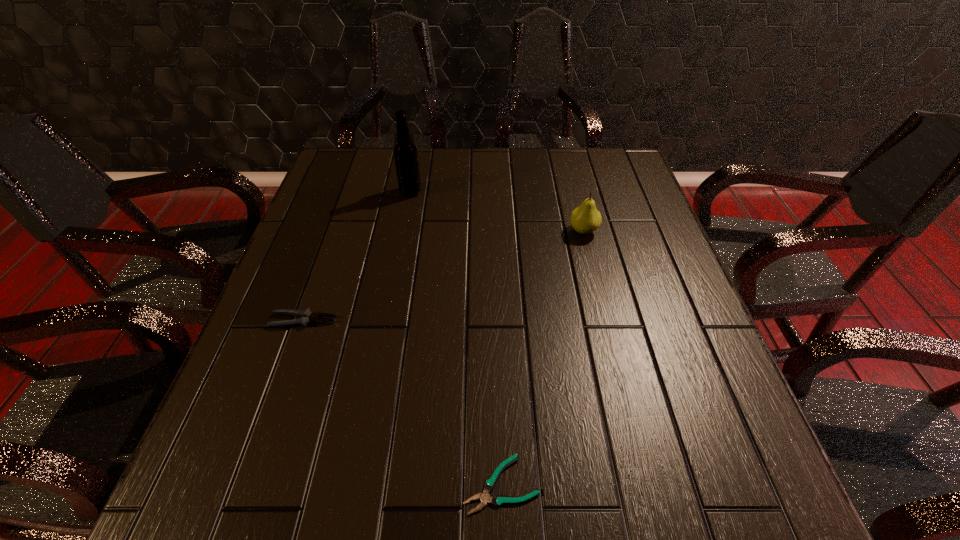
The height and width of the screenshot is (540, 960). I want to click on free space between the leftmost object and the second object from left to right, so click(357, 256).

The width and height of the screenshot is (960, 540). I want to click on vacant area that lies between the right pliers and the second farthest object, so click(x=542, y=357).

At what (x,y) coordinates should I click in order to perform the action: click on object that stands as the second closest to the pear. Please return your answer as a coordinate pair (x, y). Looking at the image, I should click on (497, 500).

Identify the location of object that is the second closest to the leftmost object. The image size is (960, 540). (405, 153).

In order to click on free location that satisfies the following two spatial constraints: 1. at the gripping part of the shortest object; 2. on the left side of the second shortest object in this screenshot , I will do (246, 484).

The image size is (960, 540). I want to click on blank area in the image that satisfies the following two spatial constraints: 1. at the gripping part of the taller pliers; 2. on the left side of the shortest object, so click(x=246, y=484).

Where is `free space that satisfies the following two spatial constraints: 1. at the gripping part of the taller pliers; 2. on the right side of the third object from left to right`? free space that satisfies the following two spatial constraints: 1. at the gripping part of the taller pliers; 2. on the right side of the third object from left to right is located at coordinates (246, 484).

Locate an element on the screen. This screenshot has height=540, width=960. free space that satisfies the following two spatial constraints: 1. at the gripping part of the left pliers; 2. on the back side of the shortest object is located at coordinates (246, 484).

Find the location of a particular element. This screenshot has height=540, width=960. free spot that satisfies the following two spatial constraints: 1. at the gripping part of the farther pliers; 2. on the back side of the third object from left to right is located at coordinates (246, 484).

The width and height of the screenshot is (960, 540). Identify the location of vacant area in the image that satisfies the following two spatial constraints: 1. on the front side of the tallest object; 2. at the gripping part of the second nearest object. (387, 320).